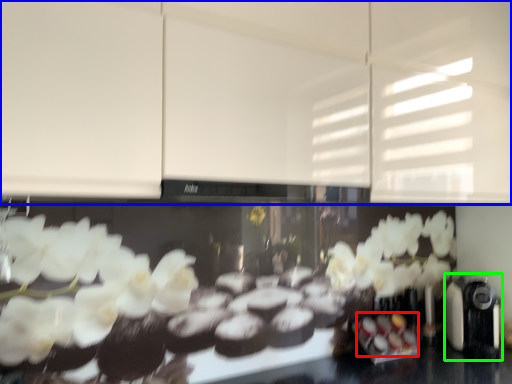
Question: Which object is positioned farthest from food (highlighted by a red box)? Select from cabinetry (highlighted by a blue box) and coffee machine (highlighted by a green box).

Choices:
 (A) cabinetry
 (B) coffee machine

Answer: (A)